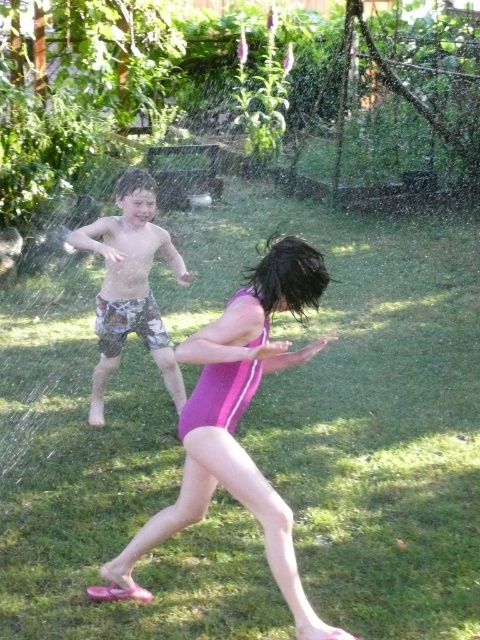
In the scene shown: You are a photographer trying to capture a photo of the purple matte swimsuit at center and camouflage shorts at left. Based on their positions, which one should you focus on first to ensure both are in frame?

The purple matte swimsuit at center is located below camouflage shorts at left, so you should focus on the camouflage shorts at left first to ensure both are in frame.

You are a drone operator trying to capture a photo of the children playing. You need to position your drone so that both the green grass at center and the camouflage shorts at left are visible in the frame. Based on their positions, which object should be placed on the left side of the photo to ensure both are in the frame?

The camouflage shorts at left should be placed on the left side of the photo because the green grass at center is to the right of the camouflage shorts at left, so positioning the camouflage shorts at left on the left side will keep both objects within the frame.